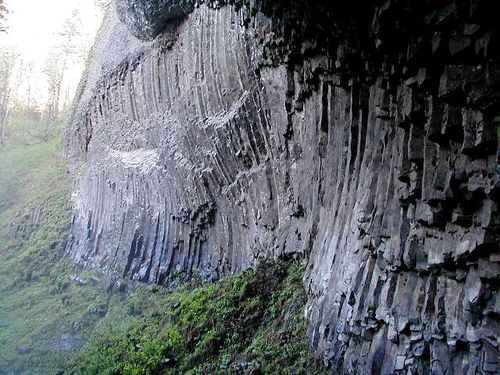
Identify the location of wall. (271, 213).